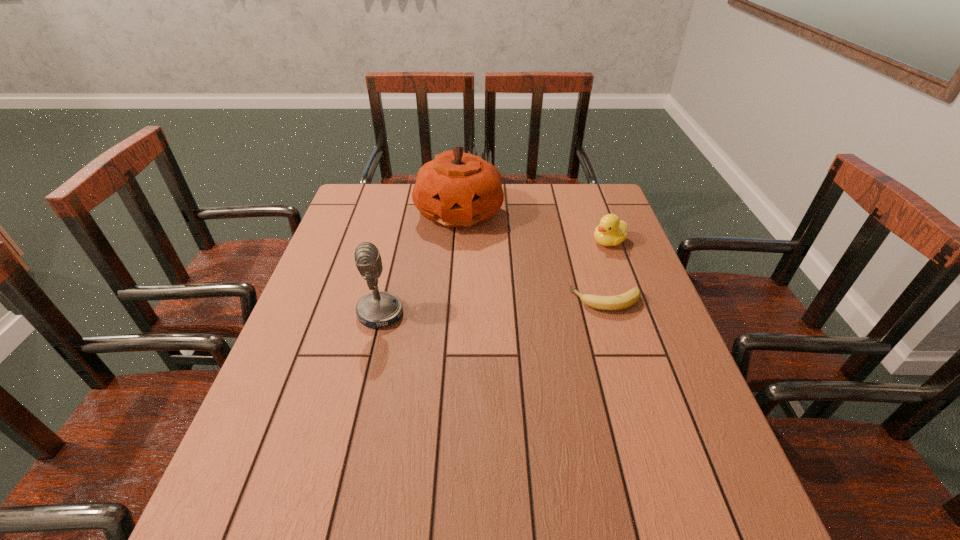
Find the location of a particular element. free space that is in between the banana and the microphone is located at coordinates (493, 307).

Locate an element on the screen. vacant area between the shortest object and the duckling is located at coordinates (608, 272).

Where is `free space between the microphone and the third tallest object`? The height and width of the screenshot is (540, 960). free space between the microphone and the third tallest object is located at coordinates (494, 278).

Find the location of a particular element. This screenshot has height=540, width=960. unoccupied position between the third tallest object and the microphone is located at coordinates (494, 278).

I want to click on vacant area between the pumpkin and the shortest object, so click(x=533, y=256).

Find the location of a particular element. The height and width of the screenshot is (540, 960). free space between the microphone and the pumpkin is located at coordinates (420, 263).

This screenshot has height=540, width=960. What are the coordinates of `object that stands as the third closest to the third tallest object` in the screenshot? It's located at (379, 308).

Identify which object is the nearest to the pumpkin. Please provide its 2D coordinates. Your answer should be formatted as a tuple, i.e. [(x, y)], where the tuple contains the x and y coordinates of a point satisfying the conditions above.

[(611, 231)]

At what (x,y) coordinates should I click in order to perform the action: click on free spot that satisfies the following two spatial constraints: 1. on the front side of the pumpkin; 2. at the stem of the shortest object. Please return your answer as a coordinate pair (x, y). Looking at the image, I should click on (454, 301).

Locate an element on the screen. The image size is (960, 540). vacant area that satisfies the following two spatial constraints: 1. on the front side of the pumpkin; 2. on the left side of the second shortest object is located at coordinates (457, 242).